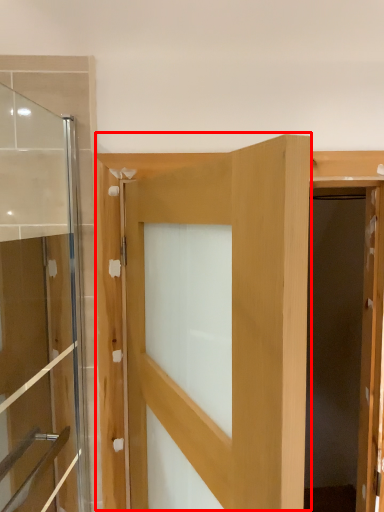
Question: In this image, where is door (annotated by the red box) located relative to door?

Choices:
 (A) right
 (B) left

Answer: (A)